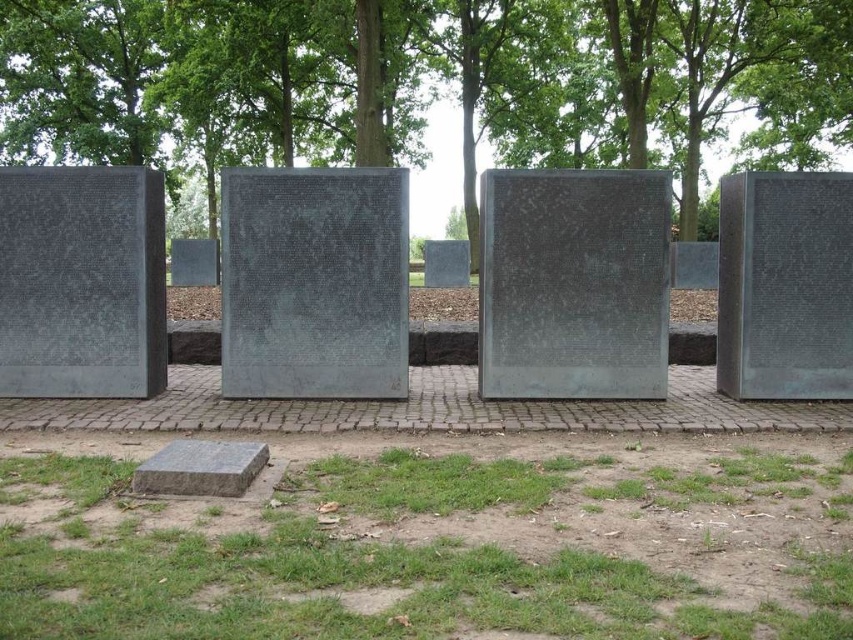
Can you confirm if brushed metal plaque at left is positioned above polished bronze plaque at center?

No.

Can you confirm if brushed metal plaque at left is positioned below polished bronze plaque at center?

Yes, brushed metal plaque at left is below polished bronze plaque at center.

Is point (155, 388) closer to viewer compared to point (730, 368)?

Yes, point (155, 388) is closer to viewer.

Where is `brushed metal plaque at left`? Image resolution: width=853 pixels, height=640 pixels. brushed metal plaque at left is located at coordinates (80, 282).

From the picture: Is green leafy tree at upper center bigger than brushed metal plaque at center?

Indeed, green leafy tree at upper center has a larger size compared to brushed metal plaque at center.

Between green leafy tree at upper center and brushed metal plaque at center, which one appears on the left side from the viewer's perspective?

brushed metal plaque at center

From the picture: Measure the distance between green leafy tree at upper center and camera.

green leafy tree at upper center is 73.11 feet from camera.

The height and width of the screenshot is (640, 853). Find the location of `green leafy tree at upper center`. green leafy tree at upper center is located at coordinates (425, 83).

Which is below, green leafy tree at upper center or polished bronze plaque at center?

polished bronze plaque at center

This screenshot has height=640, width=853. What do you see at coordinates (425, 83) in the screenshot?
I see `green leafy tree at upper center` at bounding box center [425, 83].

Identify the location of green leafy tree at upper center. This screenshot has height=640, width=853. (425, 83).